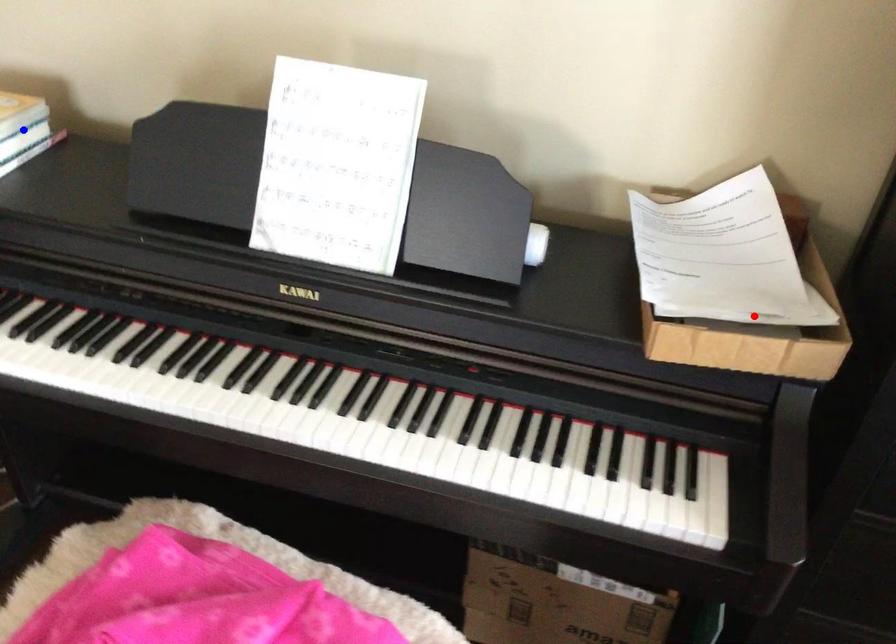
Question: Two points are marked on the image. Which point is closer to the camera?

Choices:
 (A) Blue point is closer.
 (B) Red point is closer.

Answer: (B)